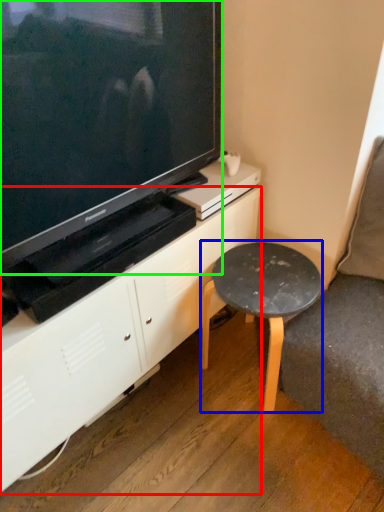
Question: Which is nearer to the cabinetry (highlighted by a red box)? stool (highlighted by a blue box) or television (highlighted by a green box).

Choices:
 (A) stool
 (B) television

Answer: (A)